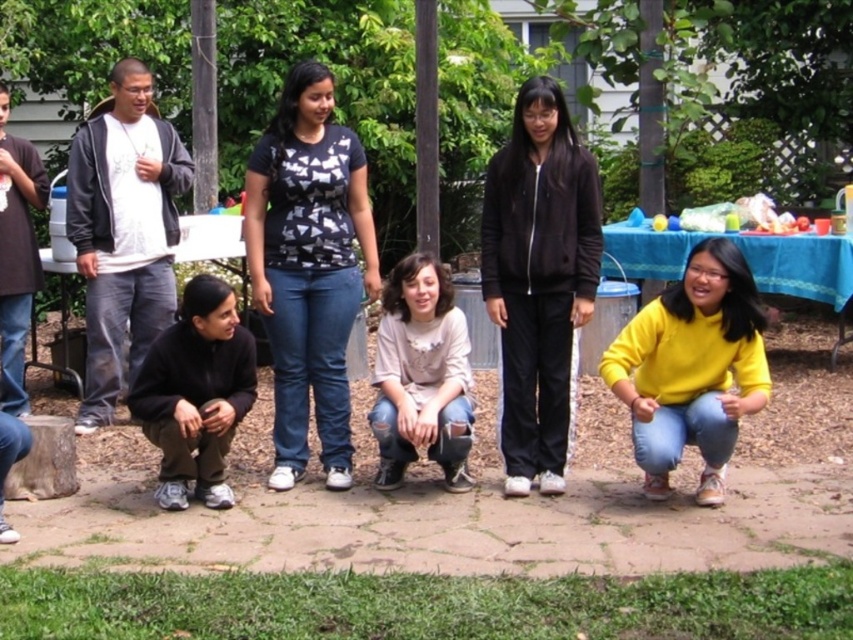
Question: Is matte black jacket at left below ripped denim jeans at center?

Choices:
 (A) no
 (B) yes

Answer: (A)

Question: Does yellow matte sweater at lower right appear on the right side of black fleece jacket at lower left?

Choices:
 (A) yes
 (B) no

Answer: (A)

Question: Which point is closer to the camera taking this photo?

Choices:
 (A) (845, 340)
 (B) (235, 316)

Answer: (B)

Question: Which object appears farthest from the camera in this image?

Choices:
 (A) matte black jacket at center
 (B) blue fabric picnic table at lower right

Answer: (B)

Question: Which point is closer to the camera?

Choices:
 (A) ripped denim jeans at center
 (B) matte black jacket at center
 (C) yellow matte sweater at lower right
 (D) matte black jacket at left

Answer: (C)

Question: Observing the image, what is the correct spatial positioning of ripped denim jeans at center in reference to blue fabric picnic table at lower right?

Choices:
 (A) above
 (B) below

Answer: (B)